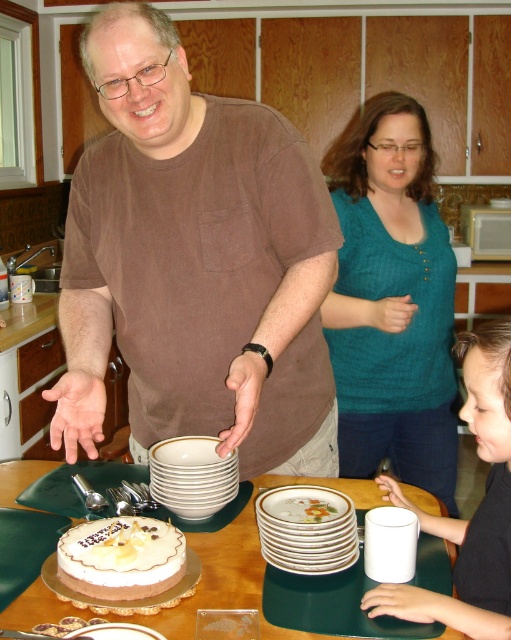
You are organizing a kitchen inventory and need to determine which item takes up more space between the brown cotton shirt at center and the black matte cup at lower right. Which one requires more storage space?

The brown cotton shirt at center has a larger size compared to the black matte cup at lower right, so it requires more storage space.

You are organizing a kitchen space and need to place the brown cotton shirt at center and the black matte cup at lower right on a shelf. If the shelf has a width of 1 meter, can both items fit side by side without overlapping?

The brown cotton shirt at center is wider than the black matte cup at lower right. Since the total width of both items combined may exceed the shelf width of 1 meter, it depends on their exact dimensions. However, the description only states the shirt is wider than the cup but does not provide specific measurements. Without knowing the exact widths, we cannot definitively determine if they will fit. Please check the actual sizes.

You are a chef who needs to grab a plate from the porcelain plates at center. You are currently standing 1 meter away from the teal knit shirt at center. Can you reach the plates without moving closer?

The distance between the teal knit shirt at center and the porcelain plates at center is 79.05 centimeters. Since you are 1 meter away from the teal knit shirt, you would be 1 meter plus 79.05 centimeters away from the plates. Therefore, you cannot reach the plates without moving closer.